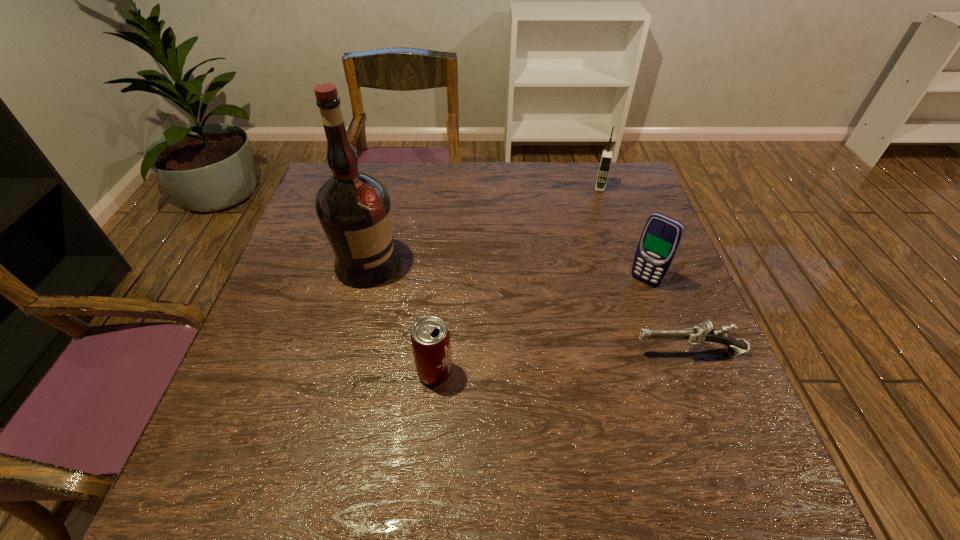
Image resolution: width=960 pixels, height=540 pixels. In order to click on free space on the desktop that is between the beer can and the gun and is positioned on the front-facing side of the nearer cellular telephone in this screenshot , I will do `click(578, 361)`.

Where is `vacant spot on the desktop that is between the fourth object from right to left and the shortest object and is positioned on the surface of the liquor`? This screenshot has height=540, width=960. vacant spot on the desktop that is between the fourth object from right to left and the shortest object and is positioned on the surface of the liquor is located at coordinates (549, 363).

Locate an element on the screen. vacant space on the desktop that is between the beer can and the shortest object and is positioned on the front-facing side of the farthest object is located at coordinates (576, 361).